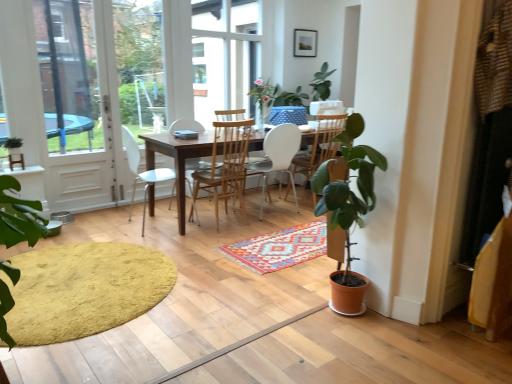
The height and width of the screenshot is (384, 512). Identify the location of vacant space underneath multicolored woven rug at center, the 1th doormat viewed from the right (from a real-world perspective). click(x=292, y=244).